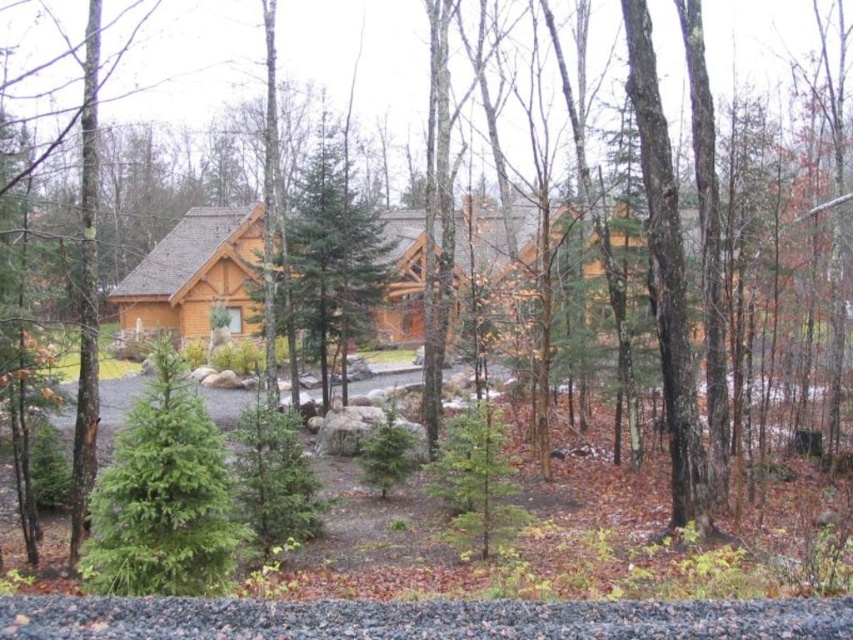
Question: Considering the relative positions of wooden cabin at center and green evergreen tree at center in the image provided, where is wooden cabin at center located with respect to green evergreen tree at center?

Choices:
 (A) right
 (B) left

Answer: (B)

Question: Which object is farther from the camera taking this photo?

Choices:
 (A) green evergreen tree at center
 (B) wooden cabin at center

Answer: (B)

Question: Does wooden cabin at center appear on the left side of green evergreen tree at center?

Choices:
 (A) no
 (B) yes

Answer: (B)

Question: Which object is closer to the camera taking this photo?

Choices:
 (A) green evergreen tree at center
 (B) green textured evergreen tree at center
 (C) wooden cabin at center

Answer: (A)

Question: Is wooden cabin at center below green evergreen tree at center?

Choices:
 (A) no
 (B) yes

Answer: (A)

Question: Which of the following is the farthest from the observer?

Choices:
 (A) green textured evergreen tree at center
 (B) wooden cabin at center
 (C) green evergreen tree at center

Answer: (A)